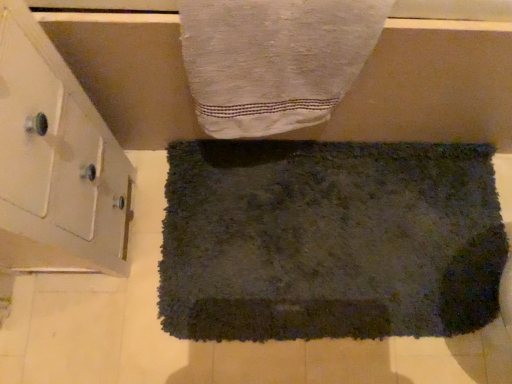
Question: Which direction should I rotate to face white textured towel at upper center, the first towel positioned from the top, — up or down?

Choices:
 (A) down
 (B) up

Answer: (B)

Question: Is white glossy cabinet at left completely or partially inside white textured towel at upper center, which is the second towel from bottom to top?

Choices:
 (A) no
 (B) yes

Answer: (A)

Question: Does white textured towel at upper center, the first towel positioned from the top, come in front of white glossy cabinet at left?

Choices:
 (A) no
 (B) yes

Answer: (A)

Question: Can you confirm if white textured towel at upper center, which is the second towel from bottom to top, is thinner than white glossy cabinet at left?

Choices:
 (A) no
 (B) yes

Answer: (B)

Question: Is white textured towel at upper center, placed as the second towel when sorted from back to front, in contact with white glossy cabinet at left?

Choices:
 (A) no
 (B) yes

Answer: (A)

Question: Is white textured towel at upper center, placed as the second towel when sorted from back to front, bigger than white glossy cabinet at left?

Choices:
 (A) yes
 (B) no

Answer: (B)

Question: Is white textured towel at upper center, placed as the second towel when sorted from back to front, positioned with its back to white glossy cabinet at left?

Choices:
 (A) yes
 (B) no

Answer: (B)

Question: Is dark gray shaggy rug at center, arranged as the second towel when viewed from the front, to the right of white glossy cabinet at left from the viewer's perspective?

Choices:
 (A) yes
 (B) no

Answer: (A)

Question: Considering the relative sizes of dark gray shaggy rug at center, which appears as the 1th towel when ordered from the bottom, and white glossy cabinet at left in the image provided, is dark gray shaggy rug at center, which appears as the 1th towel when ordered from the bottom, thinner than white glossy cabinet at left?

Choices:
 (A) no
 (B) yes

Answer: (A)

Question: Is dark gray shaggy rug at center, positioned as the first towel in back-to-front order, surrounding white glossy cabinet at left?

Choices:
 (A) no
 (B) yes

Answer: (A)

Question: From a real-world perspective, is dark gray shaggy rug at center, arranged as the second towel when viewed from the front, below white glossy cabinet at left?

Choices:
 (A) no
 (B) yes

Answer: (B)

Question: From the image's perspective, is dark gray shaggy rug at center, which is counted as the 2th towel, starting from the top, on top of white glossy cabinet at left?

Choices:
 (A) yes
 (B) no

Answer: (B)

Question: Is dark gray shaggy rug at center, positioned as the first towel in back-to-front order, facing away from white glossy cabinet at left?

Choices:
 (A) yes
 (B) no

Answer: (B)

Question: Does white textured towel at upper center, which is the second towel from bottom to top, have a lesser width compared to dark gray shaggy rug at center, which is counted as the 2th towel, starting from the top?

Choices:
 (A) yes
 (B) no

Answer: (A)